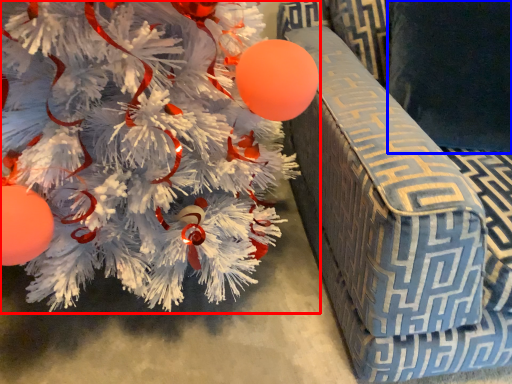
Question: Among these objects, which one is farthest to the camera, christmas tree (highlighted by a red box) or pillow (highlighted by a blue box)?

Choices:
 (A) christmas tree
 (B) pillow

Answer: (B)